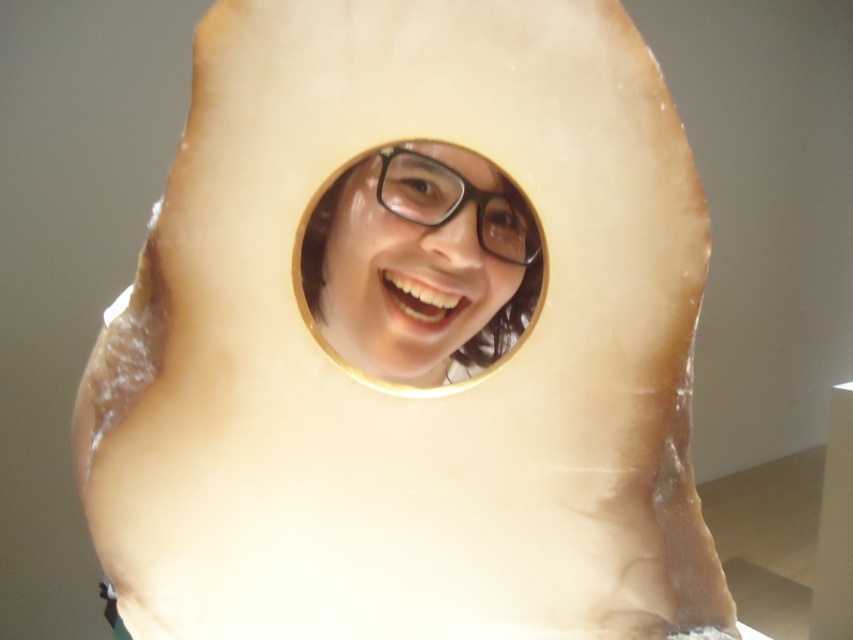
You are holding two pairs of glasses, the matte black glasses at center and the black plastic glasses at center, and want to place them on a shelf that can only hold items spaced 2 inches apart. Can both pairs be placed on the shelf without overlapping?

The matte black glasses at center is 1.81 inches away from the black plastic glasses at center, so yes, both pairs can be placed on the shelf without overlapping since the required spacing is less than the 2 inches available.

You are trying to determine which pair of glasses is more prominent in the image. Both the matte black glasses at center and the black plastic glasses at center are present. Which one stands out more in terms of height?

The matte black glasses at center is much taller than the black plastic glasses at center, so it stands out more in terms of height.